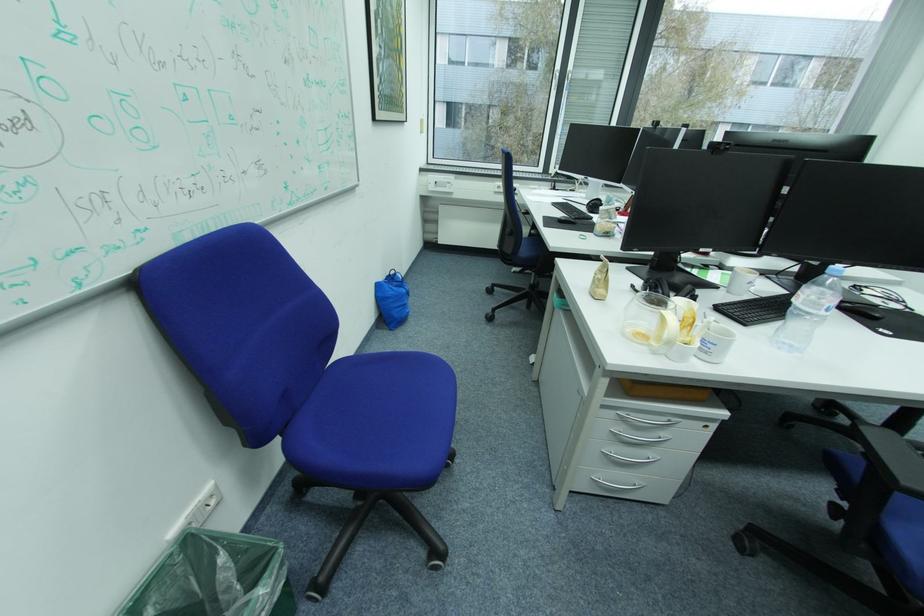
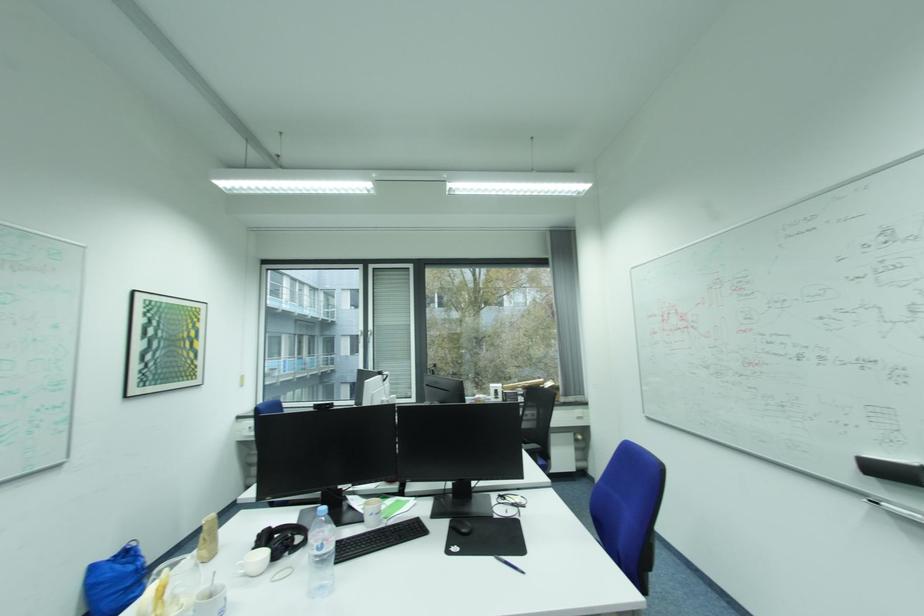
Where in the second image is the point corresponding to [833,308] from the first image?

(323, 549)